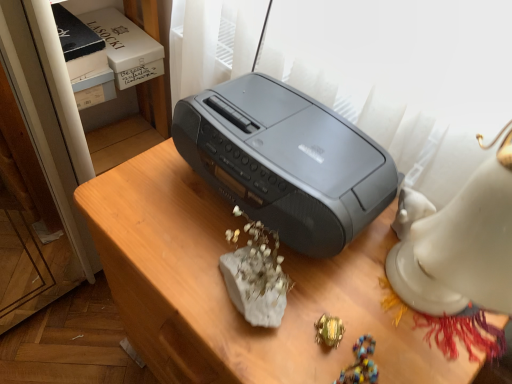
I want to click on free spot above satin gray radio at center (from a real-world perspective), so click(x=289, y=284).